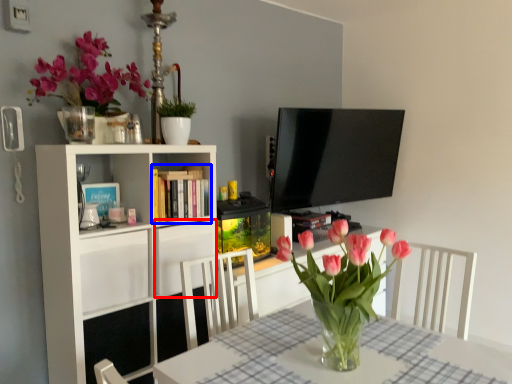
Question: Among these objects, which one is farthest to the camera, cabinet (highlighted by a red box) or book (highlighted by a blue box)?

Choices:
 (A) cabinet
 (B) book

Answer: (B)